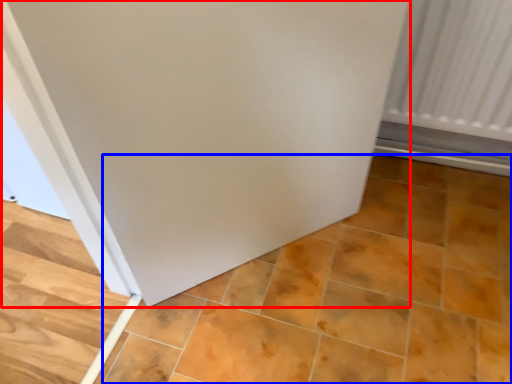
Question: Which object appears closest to the camera in this image, door (highlighted by a red box) or ceramic tile (highlighted by a blue box)?

Choices:
 (A) door
 (B) ceramic tile

Answer: (A)